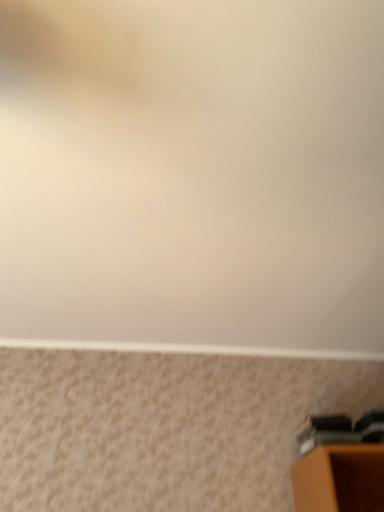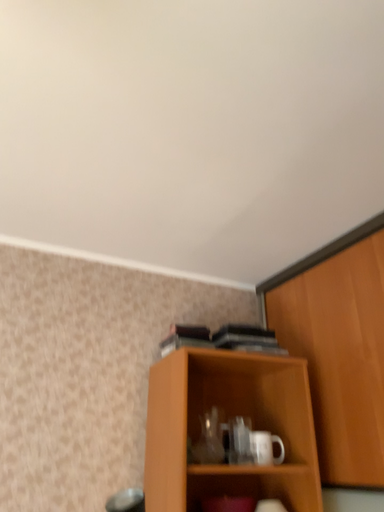
Question: Which way did the camera rotate in the video?

Choices:
 (A) rotated upward
 (B) rotated downward

Answer: (B)